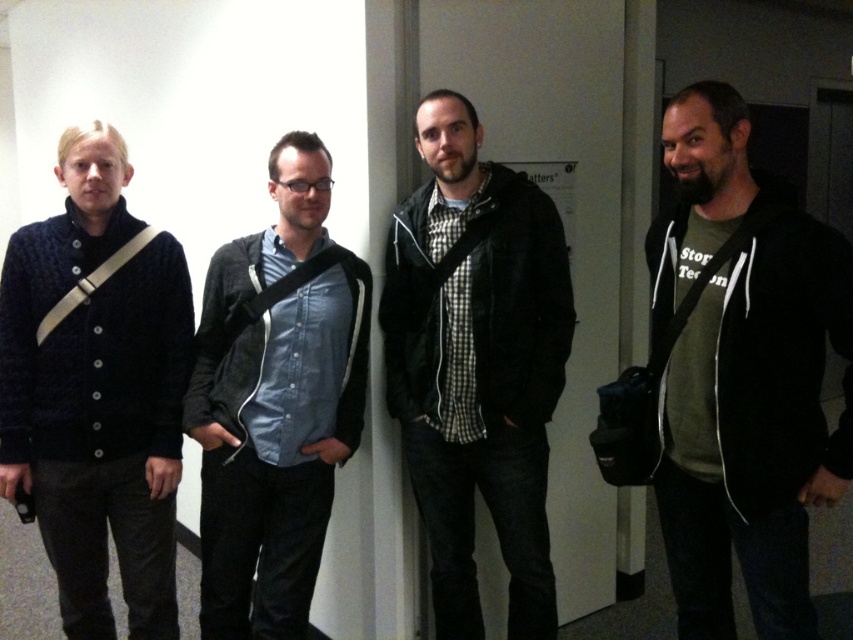
You are taking a photo of the dark green hoodie at right and the knitted dark blue sweater at left. Which one should you focus on first to ensure both are in sharp focus?

You should focus on the knitted dark blue sweater at left first because it is farther away from the viewer than the dark green hoodie at right, ensuring both are in focus.

You are a photographer setting up for a group photo. You need to ensure that the dark green hoodie at right and the checkered fabric shirt at center are at least 20 inches apart to avoid overlapping in the frame. Based on the scene description, is the current distance sufficient?

The dark green hoodie at right is only 18.57 inches away from the checkered fabric shirt at center, which is less than the required 20 inches. Therefore, the current distance is insufficient to prevent overlapping in the frame.